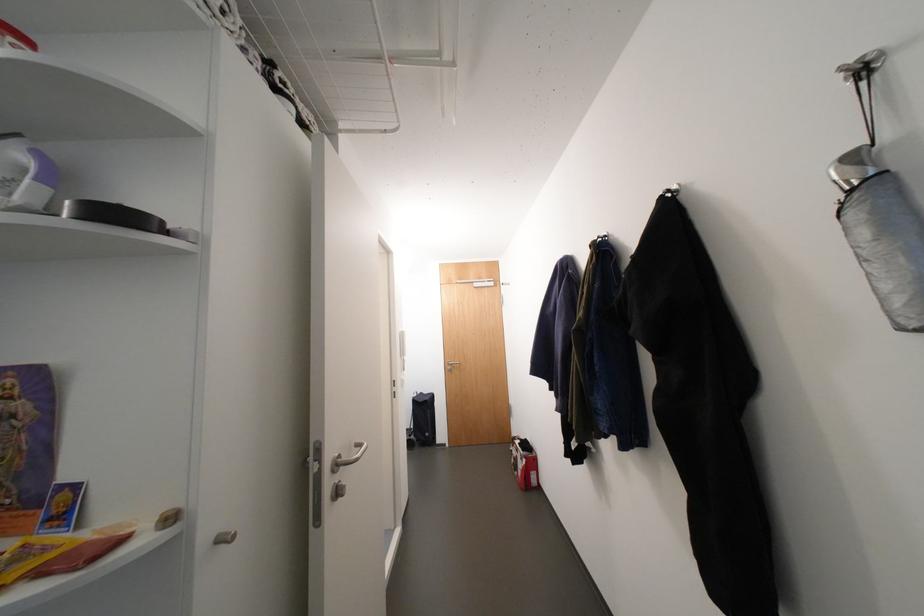
Locate an element on the screen. This screenshot has width=924, height=616. silver wall hook is located at coordinates (864, 84).